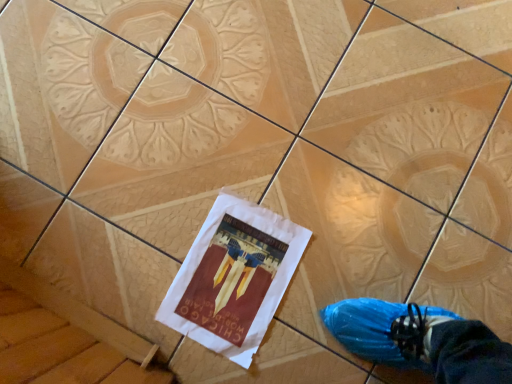
Locate an element on the screen. Image resolution: width=512 pixels, height=384 pixels. unoccupied area behind white paper postcard at lower left is located at coordinates click(246, 162).